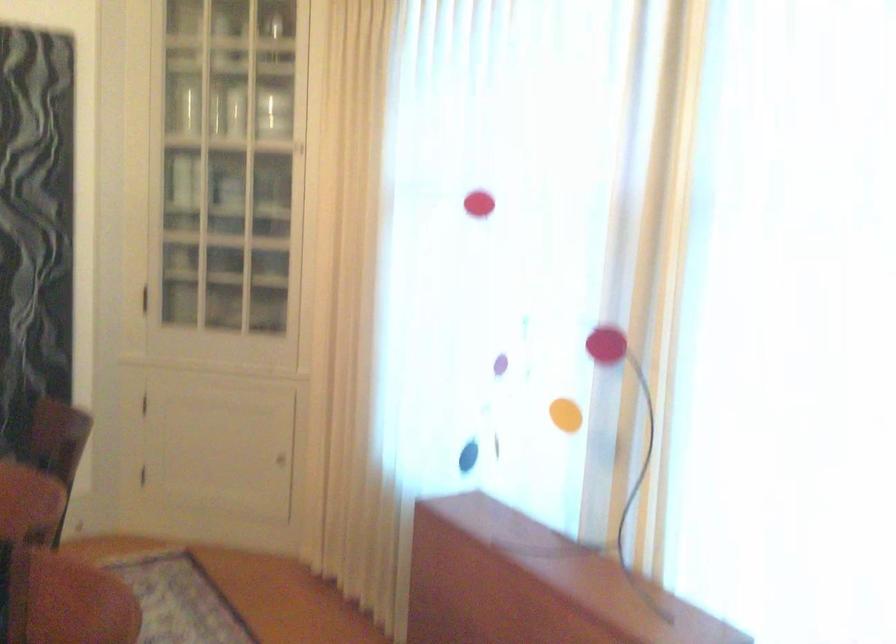
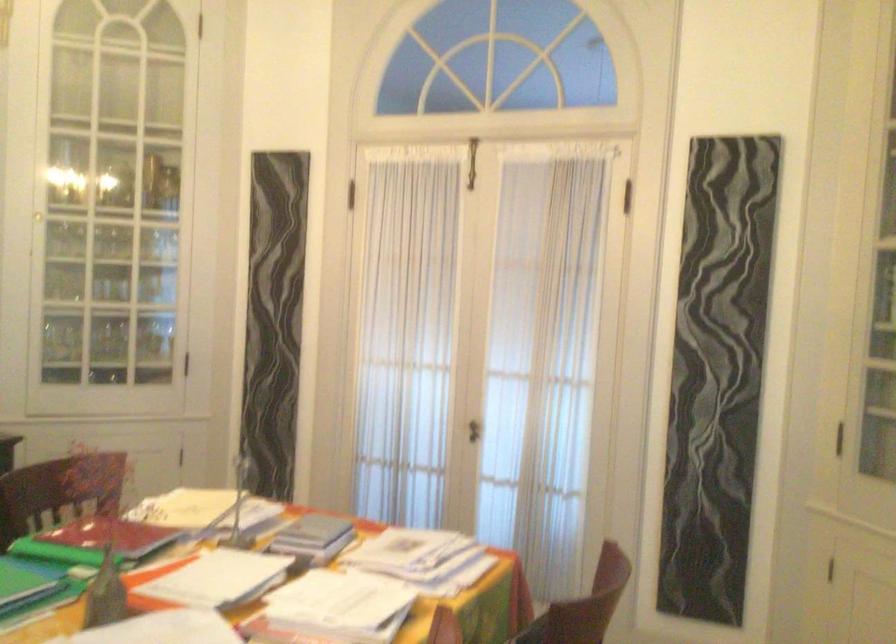
Question: The images are taken continuously from a first-person perspective. In which direction is your viewpoint rotating?

Choices:
 (A) Left
 (B) Right
 (C) Up
 (D) Down

Answer: (A)